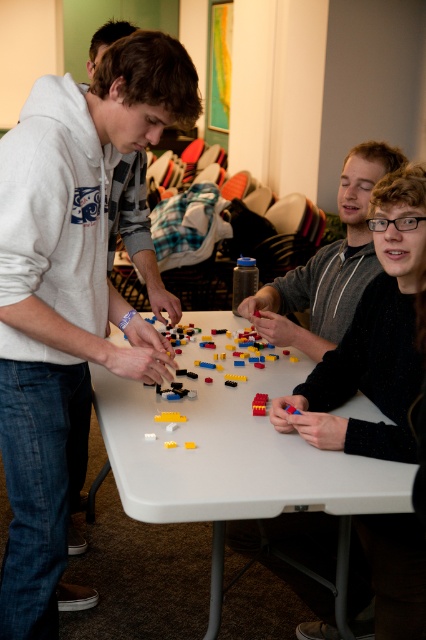
Consider the image. Is translucent plastic lego pieces at center smaller than brick red plastic blocks at center?

Actually, translucent plastic lego pieces at center might be larger than brick red plastic blocks at center.

Who is higher up, translucent plastic lego pieces at center or brick red plastic blocks at center?

Positioned higher is translucent plastic lego pieces at center.

This screenshot has height=640, width=426. Describe the element at coordinates (238, 380) in the screenshot. I see `translucent plastic lego pieces at center` at that location.

Where is `translucent plastic lego pieces at center`? Image resolution: width=426 pixels, height=640 pixels. translucent plastic lego pieces at center is located at coordinates (238, 380).

Is point (196, 502) less distant than point (258, 397)?

Yes, point (196, 502) is in front of point (258, 397).

Is white plastic table at center further to camera compared to brick red plastic blocks at center?

No, it is not.

This screenshot has width=426, height=640. Describe the element at coordinates (233, 454) in the screenshot. I see `white plastic table at center` at that location.

Find the location of a particular element. This screenshot has width=426, height=640. white plastic table at center is located at coordinates (233, 454).

Can you confirm if matte gray hoodie at left is wider than brick red plastic blocks at center?

Correct, the width of matte gray hoodie at left exceeds that of brick red plastic blocks at center.

Is matte gray hoodie at left to the left of brick red plastic blocks at center from the viewer's perspective?

Correct, you'll find matte gray hoodie at left to the left of brick red plastic blocks at center.

Is point (63, 352) behind point (261, 401)?

No, (63, 352) is closer to viewer.

The height and width of the screenshot is (640, 426). I want to click on matte gray hoodie at left, so click(x=74, y=291).